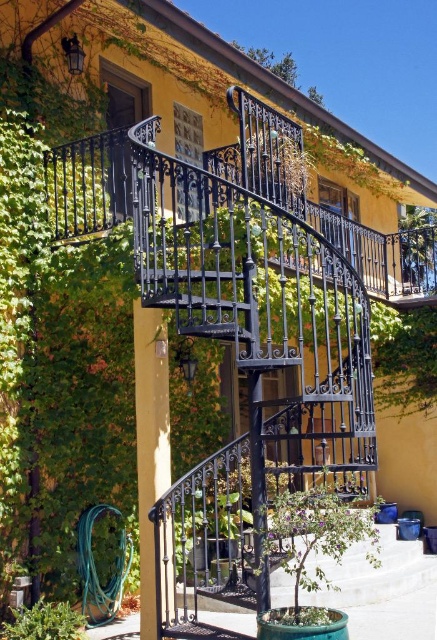
You are standing at the base of the spiral staircase and want to water both green leafy plant at center and green leafy plant at lower left. Which plant should you water first to minimize walking distance?

The green leafy plant at center is closer to you than the green leafy plant at lower left, so you should water the green leafy plant at center first to minimize walking distance.

You are a gardener who needs to water both plants. Given that your watering can has a capacity of 5 feet, can you reach from the green leafy plant at center to the green leafy plant at lower left without moving the watering can?

The distance between the green leafy plant at center and the green leafy plant at lower left is 4.97 feet, which is less than the 5 feet capacity of the watering can. Therefore, you can reach both plants without moving the watering can.